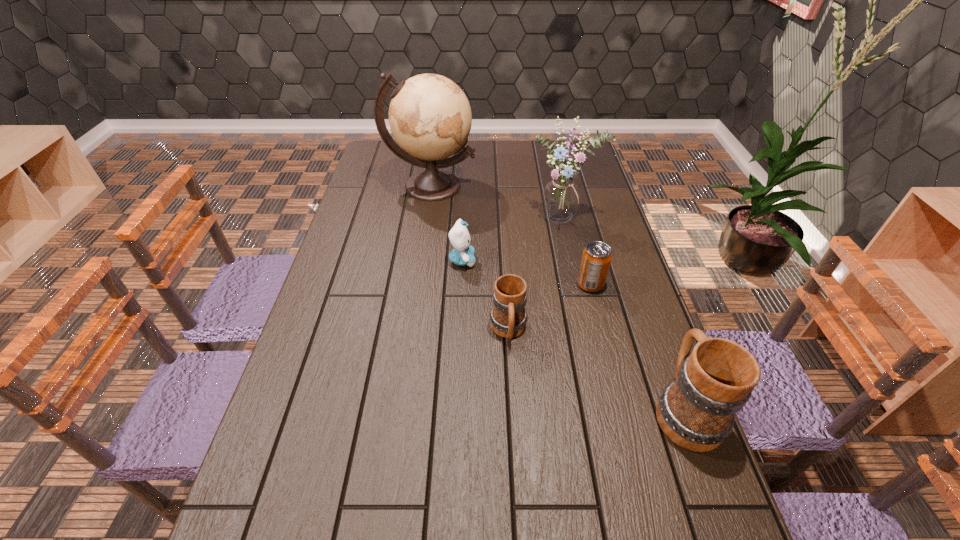
At what (x,y) coordinates should I click in order to perform the action: click on free space located on the side of the nearer mug with the handle. Please return your answer as a coordinate pair (x, y). Looking at the image, I should click on (644, 298).

The height and width of the screenshot is (540, 960). Identify the location of vacant space situated 0.380m on the side of the nearer mug with the handle. (632, 265).

At what (x,y) coordinates should I click in order to perform the action: click on vacant area situated 0.150m on the front-facing side of the globe. Please return your answer as a coordinate pair (x, y). Looking at the image, I should click on (424, 234).

Locate an element on the screen. blank area located 0.310m on the face of the kitten is located at coordinates (576, 260).

You are a GUI agent. You are given a task and a screenshot of the screen. Output one action in this format:
    pyautogui.click(x=<x>, y=<y>)
    Task: Click on the vacant space situated on the front-facing side of the bouquet
    The image size is (960, 540).
    Given the screenshot: What is the action you would take?
    pyautogui.click(x=588, y=323)

Identify the location of vacant area located on the right of the third nearest object. This screenshot has height=540, width=960. (628, 284).

Find the location of a particular element. object that is at the far edge is located at coordinates (430, 118).

At what (x,y) coordinates should I click in order to perform the action: click on object that is at the left edge. Please return your answer as a coordinate pair (x, y). Looking at the image, I should click on (430, 118).

Where is `mug at the right edge`? Image resolution: width=960 pixels, height=540 pixels. mug at the right edge is located at coordinates (696, 411).

You are a GUI agent. You are given a task and a screenshot of the screen. Output one action in this format:
    pyautogui.click(x=<x>, y=<y>)
    Task: Click on the bouquet that is at the right edge
    This screenshot has width=960, height=540.
    Given the screenshot: What is the action you would take?
    pyautogui.click(x=561, y=197)